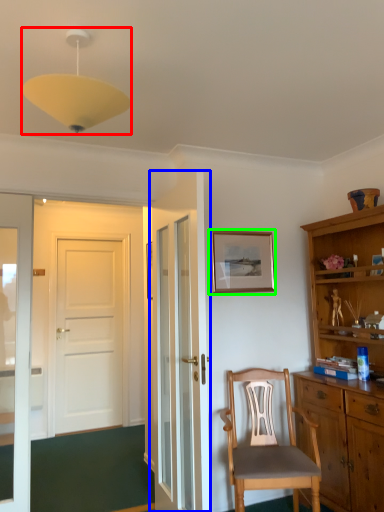
Question: Which object is positioned farthest from light fixture (highlighted by a red box)? Select from door (highlighted by a blue box) and picture frame (highlighted by a green box).

Choices:
 (A) door
 (B) picture frame

Answer: (B)